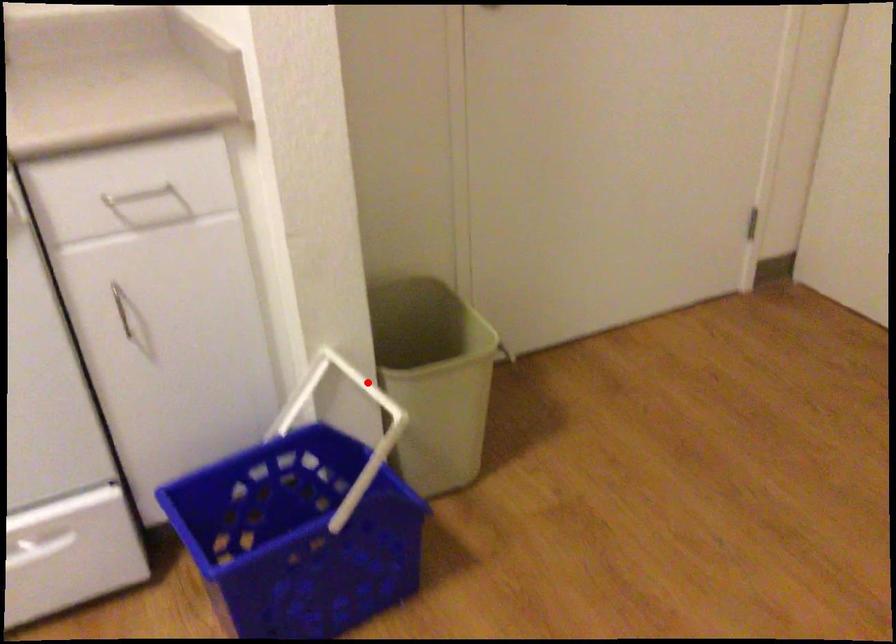
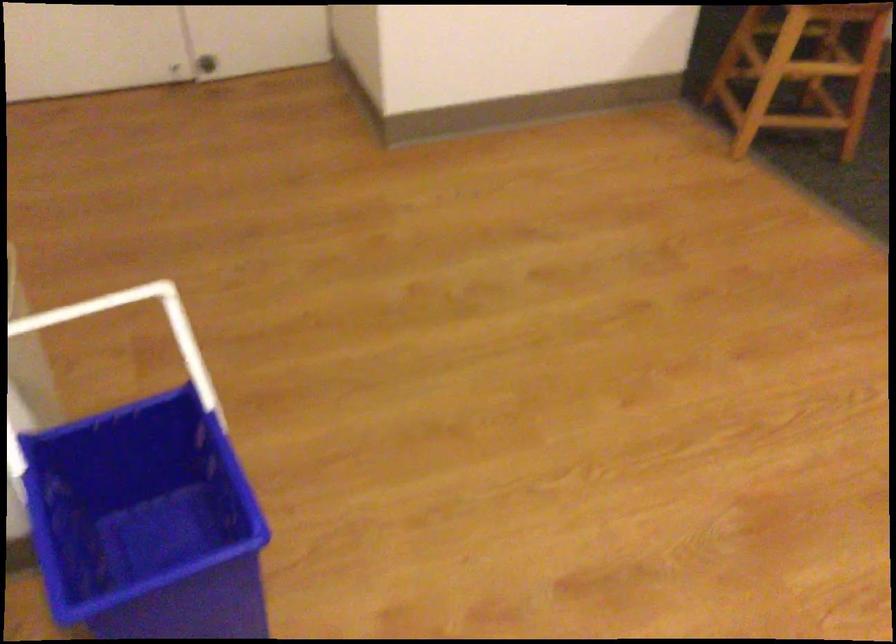
Question: I am providing you with two images of the same scene from different viewpoints. In image1, a red point is highlighted. Considering the same 3D point in image2, which of the following is correct?

Choices:
 (A) It is closer
 (B) It is farther

Answer: (A)